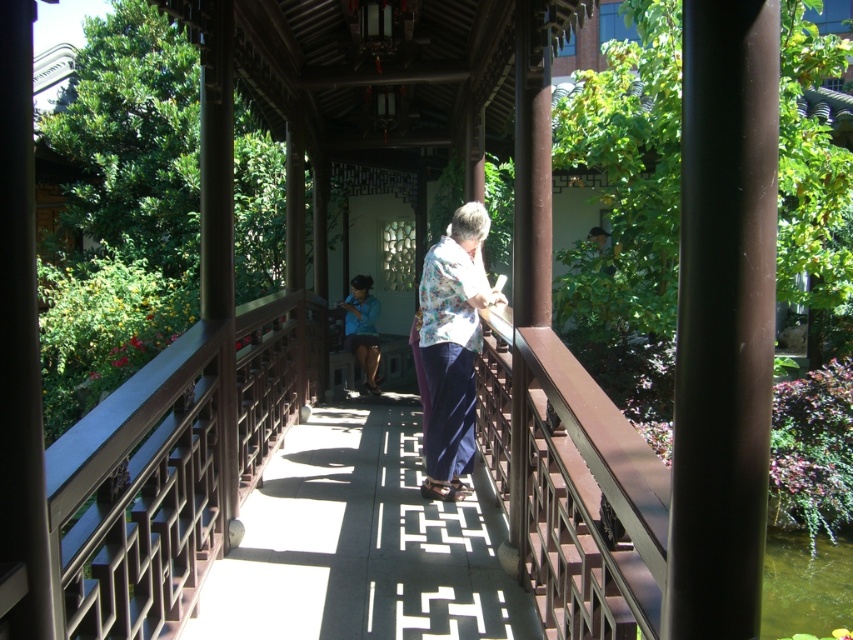
You are standing in the traditional covered walkway and notice a person wearing a specific item. Where exactly is the floral fabric shirt at center located in this scene?

The floral fabric shirt at center is located at point 0.545 on the x axis and 0.531 on the y axis.

From the picture: You are standing at the entrance of the walkway and want to reach the brown wooden bridge at center. There is a person wearing a floral fabric shirt at center blocking your path. Can you walk around them to reach the bridge?

The brown wooden bridge at center is closer to the viewer than the floral fabric shirt at center, so the person wearing the floral fabric shirt at center is between you and the bridge. You cannot walk around them without moving past the person.